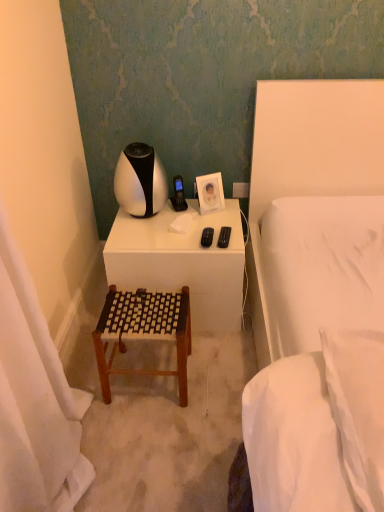
You are a GUI agent. You are given a task and a screenshot of the screen. Output one action in this format:
    pyautogui.click(x=<x>, y=<y>)
    Task: Click on the free point above brown woven stool at center (from a real-world perspective)
    The width and height of the screenshot is (384, 512).
    Given the screenshot: What is the action you would take?
    pyautogui.click(x=145, y=301)